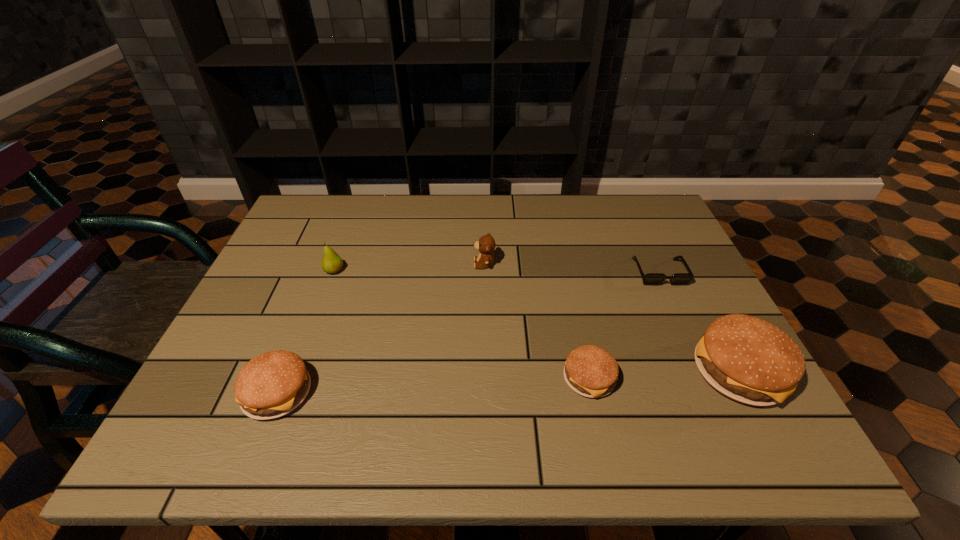
You are a GUI agent. You are given a task and a screenshot of the screen. Output one action in this format:
    pyautogui.click(x=<x>, y=<y>)
    Task: Click on the object that is at the near right corner
    The width and height of the screenshot is (960, 540).
    Given the screenshot: What is the action you would take?
    pyautogui.click(x=747, y=359)

I want to click on free space at the far edge, so click(613, 222).

The height and width of the screenshot is (540, 960). In the image, there is a desktop. Find the location of `vacant area at the near edge`. vacant area at the near edge is located at coordinates (428, 377).

Find the location of a particular element. This screenshot has height=540, width=960. vacant space at the left edge of the desktop is located at coordinates (313, 240).

The width and height of the screenshot is (960, 540). In the image, there is a desktop. Identify the location of vacant space at the far left corner. (328, 195).

Locate an element on the screen. Image resolution: width=960 pixels, height=540 pixels. free region at the far right corner is located at coordinates (667, 221).

You are a GUI agent. You are given a task and a screenshot of the screen. Output one action in this format:
    pyautogui.click(x=<x>, y=<y>)
    Task: Click on the vacant space at the near right corner of the desktop
    The height and width of the screenshot is (540, 960).
    Given the screenshot: What is the action you would take?
    pyautogui.click(x=707, y=386)

You are a GUI agent. You are given a task and a screenshot of the screen. Output one action in this format:
    pyautogui.click(x=<x>, y=<y>)
    Task: Click on the free space between the teddy bear and the fourth object from left to right
    The image size is (960, 540).
    Given the screenshot: What is the action you would take?
    pyautogui.click(x=537, y=321)

At what (x,y) coordinates should I click in order to perform the action: click on empty space that is in between the rightmost hamburger and the leftmost hamburger. Please return your answer as a coordinate pair (x, y). The height and width of the screenshot is (540, 960). Looking at the image, I should click on (508, 382).

At what (x,y) coordinates should I click in order to perform the action: click on vacant area that lies between the leftmost hamburger and the rightmost hamburger. Please return your answer as a coordinate pair (x, y). Image resolution: width=960 pixels, height=540 pixels. Looking at the image, I should click on (508, 382).